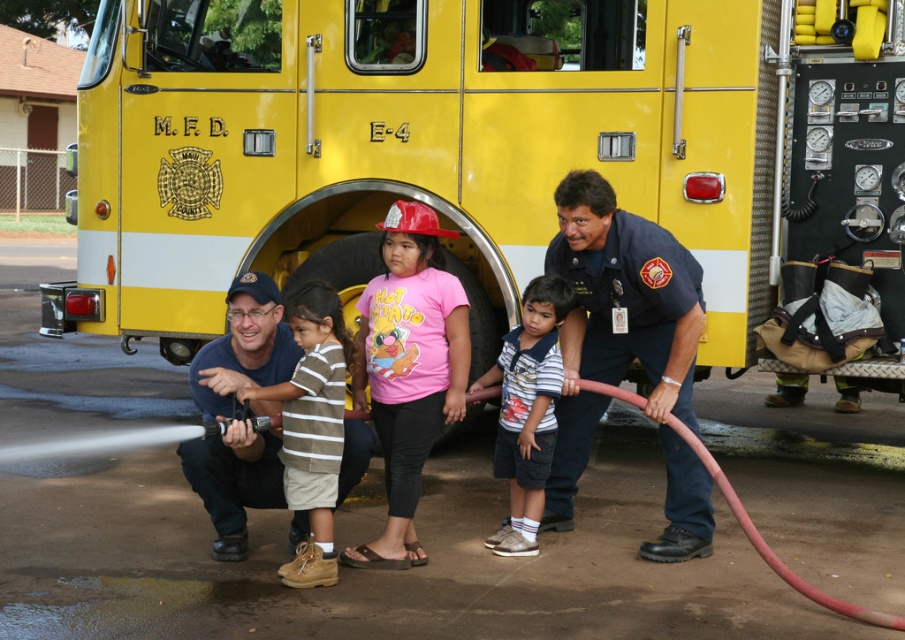
You are a photographer standing at the front of the yellow matte fire truck at center and the pink cotton shirt at center. You want to take a photo that includes both objects in focus. Which object should you focus on first to ensure both are in the frame?

The yellow matte fire truck at center is closer to you than the pink cotton shirt at center, so you should focus on the yellow matte fire truck at center first to ensure both are in the frame.

You are standing at the point labeled point (315, 288) and want to walk to the point labeled point (724, 488). Which direction should you move to reach your destination?

To reach point (724, 488) from point (315, 288), you should move forward since point (315, 288) is behind point (724, 488).